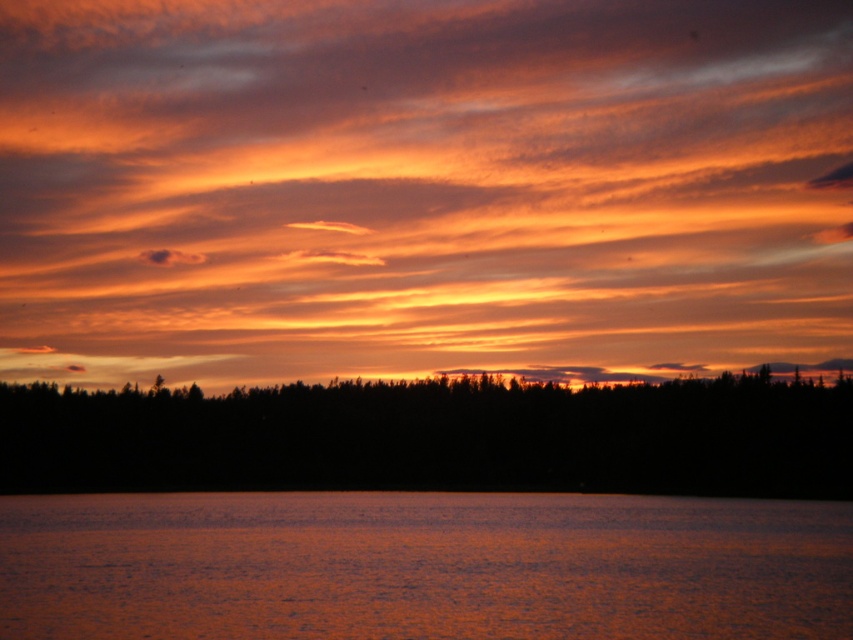
Looking at this image, is the position of orange matte cloud at upper center more distant than that of orange reflective water at bottom?

Yes, orange matte cloud at upper center is behind orange reflective water at bottom.

Does point (96, 3) come closer to viewer compared to point (804, 502)?

No.

Where is `orange matte cloud at upper center`? This screenshot has height=640, width=853. orange matte cloud at upper center is located at coordinates (422, 188).

The image size is (853, 640). Find the location of `orange matte cloud at upper center`. orange matte cloud at upper center is located at coordinates (422, 188).

Can you confirm if orange reflective water at bottom is bigger than black silhouette trees at bottom?

Incorrect, orange reflective water at bottom is not larger than black silhouette trees at bottom.

Can you confirm if orange reflective water at bottom is shorter than black silhouette trees at bottom?

Correct, orange reflective water at bottom is not as tall as black silhouette trees at bottom.

Describe the element at coordinates (422, 566) in the screenshot. I see `orange reflective water at bottom` at that location.

This screenshot has width=853, height=640. I want to click on orange reflective water at bottom, so click(x=422, y=566).

Is point (726, 179) more distant than point (334, 433)?

Yes, point (726, 179) is behind point (334, 433).

Who is shorter, orange matte cloud at upper center or black silhouette trees at bottom?

Standing shorter between the two is black silhouette trees at bottom.

Is point (705, 160) closer to viewer compared to point (433, 435)?

That is False.

Find the location of `orange matte cloud at upper center`. orange matte cloud at upper center is located at coordinates (422, 188).